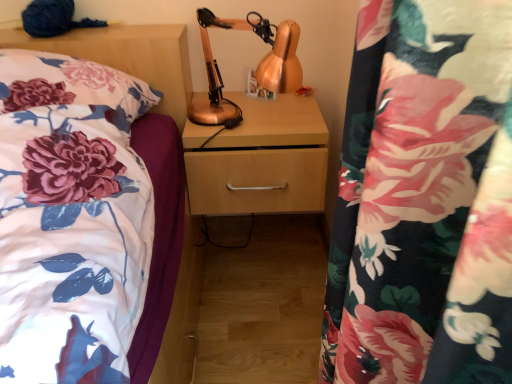
Question: Should I look upward or downward to see wooden drawer at center?

Choices:
 (A) up
 (B) down

Answer: (A)

Question: From the image's perspective, is wooden drawer at center located beneath floral fabric pillow at left?

Choices:
 (A) no
 (B) yes

Answer: (B)

Question: Can you confirm if wooden drawer at center is positioned to the right of floral fabric pillow at left?

Choices:
 (A) yes
 (B) no

Answer: (A)

Question: Is wooden drawer at center wider than floral fabric pillow at left?

Choices:
 (A) yes
 (B) no

Answer: (B)

Question: From a real-world perspective, does wooden drawer at center stand above floral fabric pillow at left?

Choices:
 (A) no
 (B) yes

Answer: (A)

Question: Considering the relative sizes of wooden drawer at center and floral fabric pillow at left in the image provided, is wooden drawer at center bigger than floral fabric pillow at left?

Choices:
 (A) no
 (B) yes

Answer: (A)

Question: Does wooden drawer at center lie in front of floral fabric pillow at left?

Choices:
 (A) no
 (B) yes

Answer: (A)

Question: Considering the relative sizes of floral fabric pillow at left and copper metallic table lamp at center in the image provided, is floral fabric pillow at left shorter than copper metallic table lamp at center?

Choices:
 (A) no
 (B) yes

Answer: (B)

Question: Is floral fabric pillow at left taller than copper metallic table lamp at center?

Choices:
 (A) yes
 (B) no

Answer: (B)

Question: Is floral fabric pillow at left thinner than copper metallic table lamp at center?

Choices:
 (A) no
 (B) yes

Answer: (A)

Question: Is the depth of floral fabric pillow at left greater than that of copper metallic table lamp at center?

Choices:
 (A) no
 (B) yes

Answer: (A)

Question: Does floral fabric pillow at left appear on the left side of copper metallic table lamp at center?

Choices:
 (A) no
 (B) yes

Answer: (B)

Question: Does floral fabric pillow at left have a greater width compared to copper metallic table lamp at center?

Choices:
 (A) no
 (B) yes

Answer: (B)

Question: Is copper metallic table lamp at center facing towards wooden drawer at center?

Choices:
 (A) yes
 (B) no

Answer: (B)